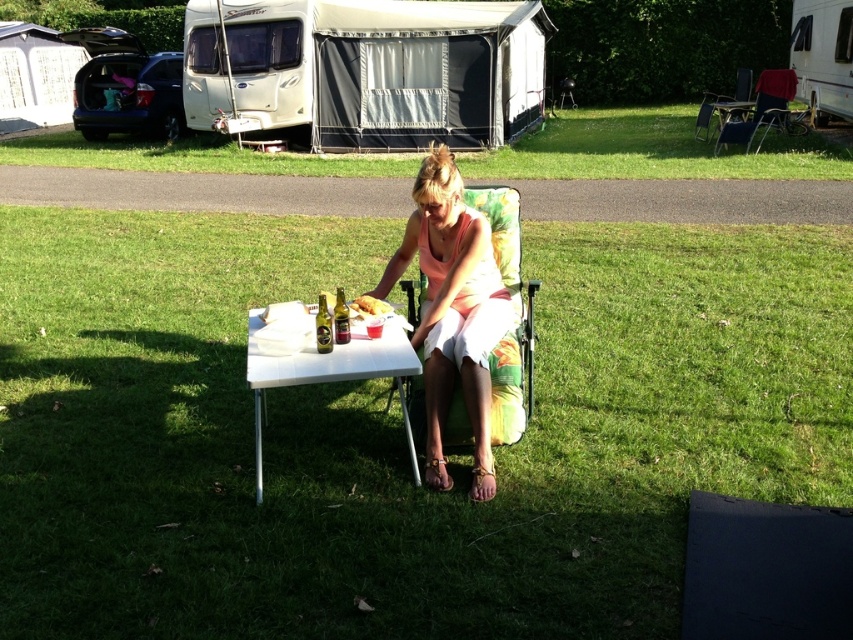
Question: Which object is closer to the camera taking this photo?

Choices:
 (A) white plastic camper at upper right
 (B) metallic gold can at center
 (C) white plastic table at center

Answer: (C)

Question: Is metallic gold can at center above translucent glass bottle at center?

Choices:
 (A) yes
 (B) no

Answer: (B)

Question: Which object is farther from the camera taking this photo?

Choices:
 (A) red fabric chair at upper right
 (B) metallic silver chair at upper right
 (C) white plastic camper at upper right
 (D) green grass at center

Answer: (B)

Question: Is green grass at center above white fabric camper at upper center?

Choices:
 (A) yes
 (B) no

Answer: (B)

Question: Which of the following is the farthest from the observer?

Choices:
 (A) (712, 106)
 (B) (746, 120)
 (C) (764, 118)

Answer: (A)

Question: Is white plastic table at center behind metallic silver chair at upper right?

Choices:
 (A) yes
 (B) no

Answer: (B)